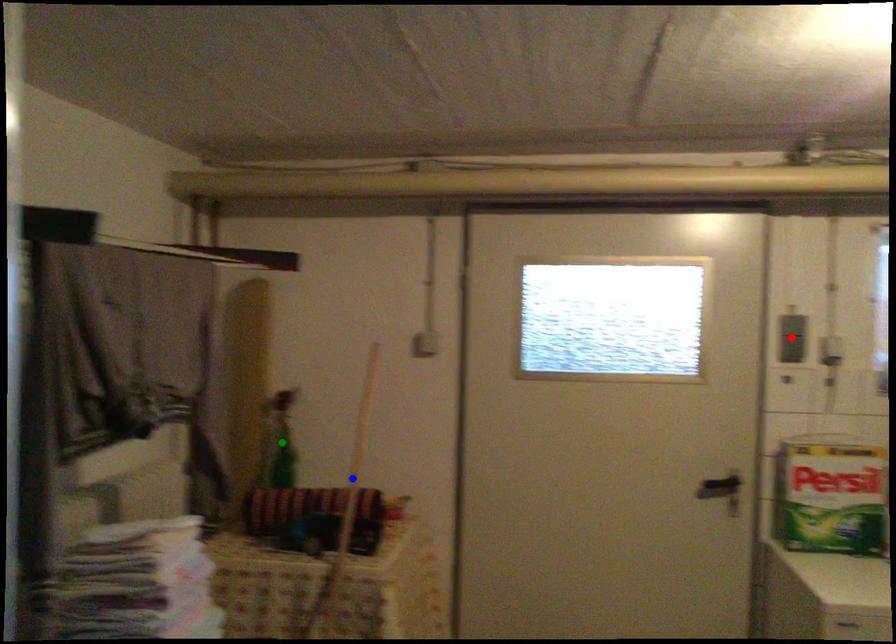
Order these from farthest to nearest:
- blue point
- red point
- green point

green point → red point → blue point